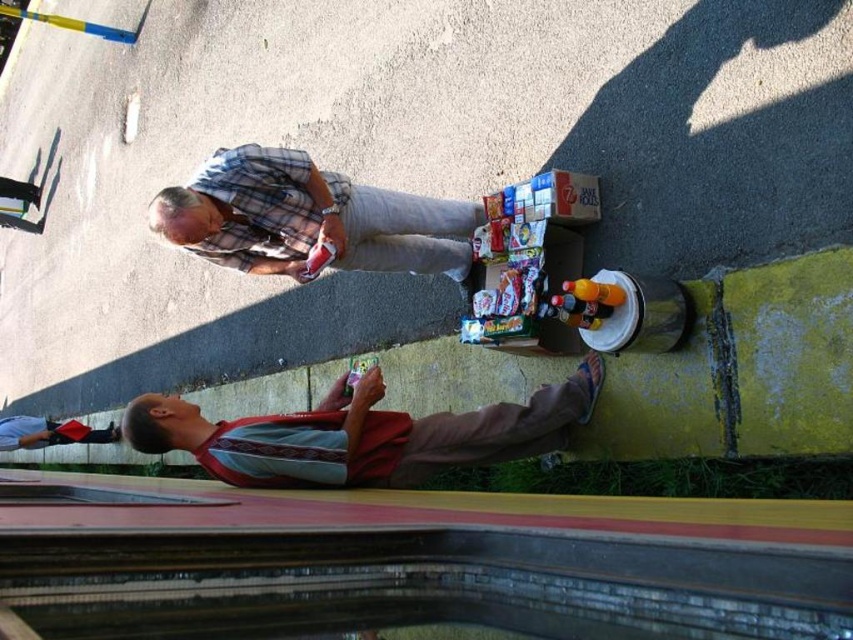
Question: Is the position of reddish-brown fabric shirt at lower left more distant than that of red fabric shirt at lower left?

Choices:
 (A) yes
 (B) no

Answer: (B)

Question: Is reddish-brown fabric shirt at lower left thinner than red fabric shirt at lower left?

Choices:
 (A) no
 (B) yes

Answer: (B)

Question: Can you confirm if plaid shirt at center is smaller than red fabric shirt at lower left?

Choices:
 (A) yes
 (B) no

Answer: (A)

Question: Among these objects, which one is farthest from the camera?

Choices:
 (A) plaid shirt at center
 (B) reddish-brown fabric shirt at lower left

Answer: (A)

Question: Which object is closer to the camera taking this photo?

Choices:
 (A) plaid shirt at center
 (B) reddish-brown fabric shirt at lower left

Answer: (B)

Question: Which point appears closest to the camera in this image?

Choices:
 (A) (426, 461)
 (B) (199, 209)

Answer: (B)